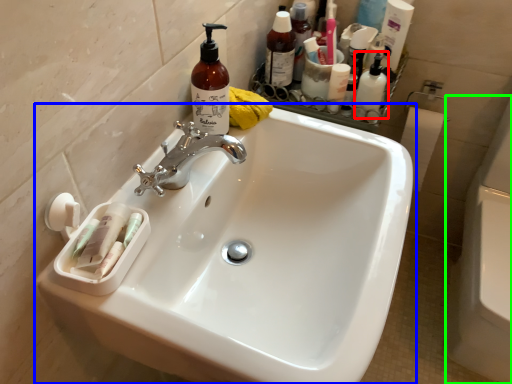
Question: Based on their relative distances, which object is farther from toiletry (highlighted by a red box)? Choose from sink (highlighted by a blue box) and bath (highlighted by a green box).

Choices:
 (A) sink
 (B) bath

Answer: (B)